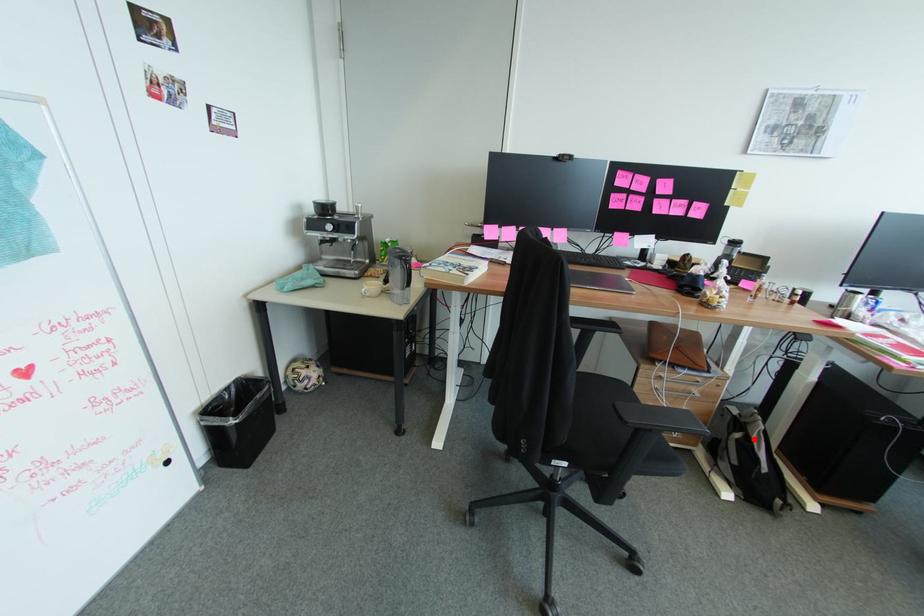
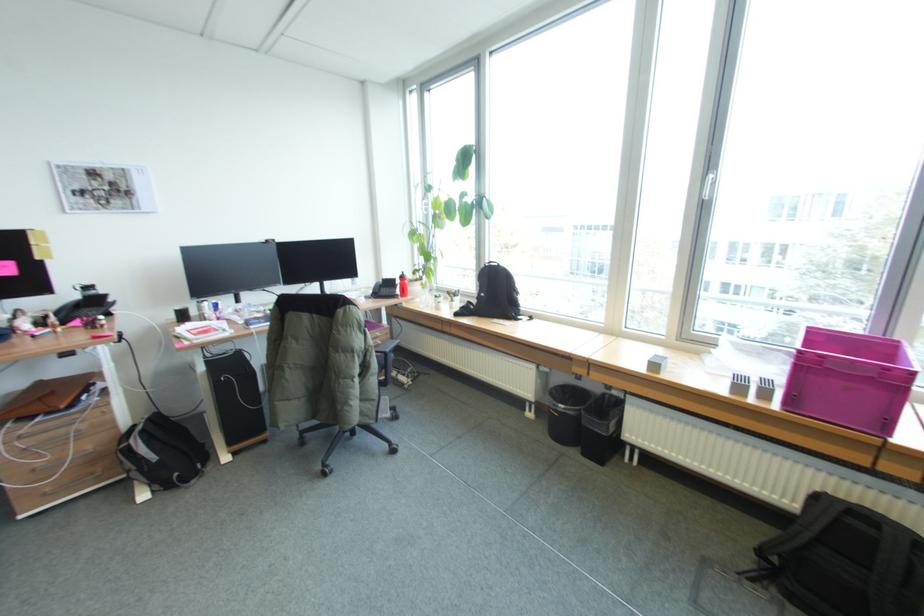
Question: I am providing you with two images of the same scene from different viewpoints. A red point is marked on the first image. Is the red point's position out of view in image 2?

Choices:
 (A) Yes
 (B) No

Answer: (B)